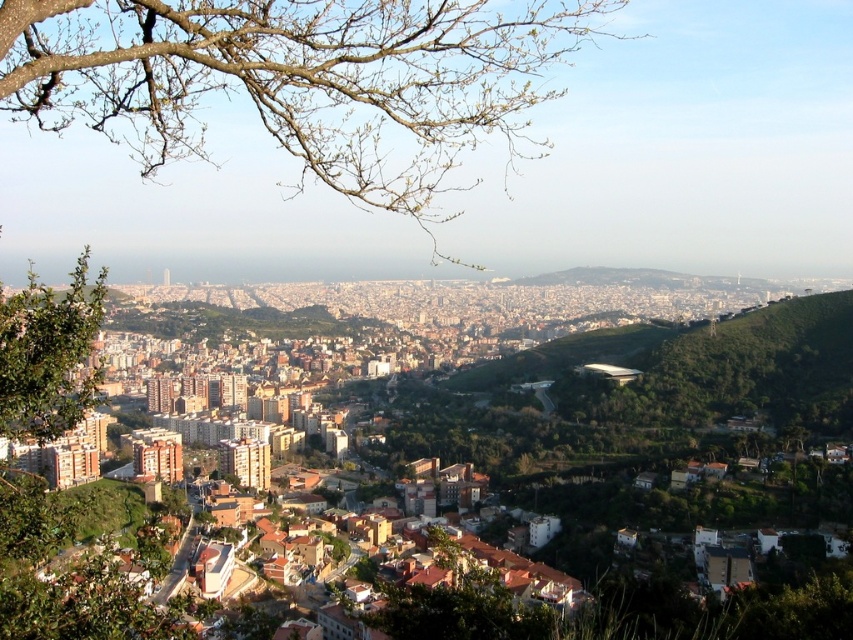
Question: Can you confirm if bare branches at upper left is wider than green leafy tree at left?

Choices:
 (A) no
 (B) yes

Answer: (B)

Question: Does brown brick buildings at center have a lesser width compared to green leafy tree at left?

Choices:
 (A) yes
 (B) no

Answer: (B)

Question: Among these objects, which one is nearest to the camera?

Choices:
 (A) brown brick buildings at center
 (B) green leafy tree at left
 (C) bare branches at upper left

Answer: (B)

Question: Can you confirm if brown brick buildings at center is positioned above green leafy tree at left?

Choices:
 (A) yes
 (B) no

Answer: (A)

Question: Which object is the closest to the brown brick buildings at center?

Choices:
 (A) bare branches at upper left
 (B) green leafy tree at left

Answer: (B)

Question: Which of these objects is positioned farthest from the bare branches at upper left?

Choices:
 (A) green leafy tree at left
 (B) brown brick buildings at center

Answer: (A)